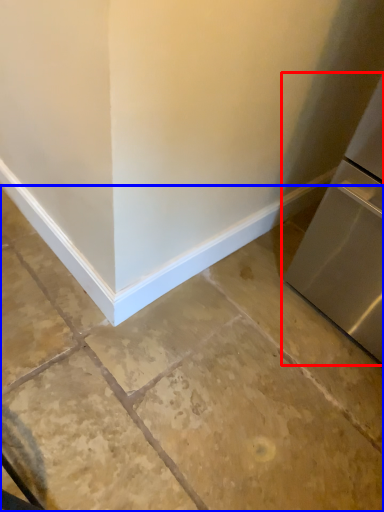
Question: Which of the following is the closest to the observer, refrigerator (highlighted by a red box) or concrete (highlighted by a blue box)?

Choices:
 (A) refrigerator
 (B) concrete

Answer: (A)